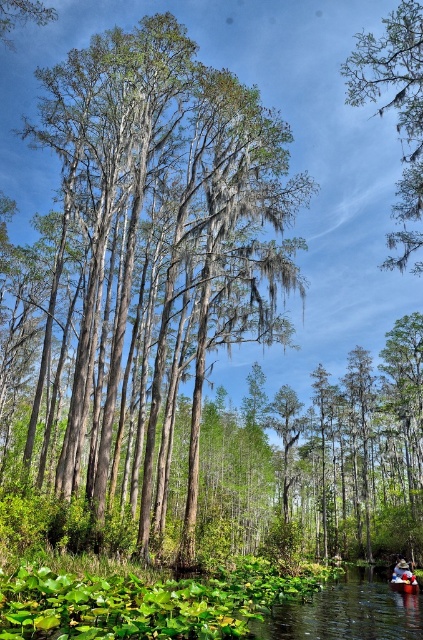
Question: Which point is closer to the camera?

Choices:
 (A) green mossy branch at upper right
 (B) green leafy river at lower center
 (C) fluffy white teddy bear at lower right
 (D) wooden canoe at center

Answer: (B)

Question: Is green mossy branch at upper right to the right of green leafy river at lower center from the viewer's perspective?

Choices:
 (A) yes
 (B) no

Answer: (A)

Question: Which of the following is the farthest from the observer?

Choices:
 (A) smooth bark tree at center
 (B) fluffy white teddy bear at lower right
 (C) wooden canoe at center

Answer: (B)

Question: Is smooth bark tree at center behind green mossy branch at upper right?

Choices:
 (A) yes
 (B) no

Answer: (A)

Question: Among these objects, which one is nearest to the camera?

Choices:
 (A) green mossy branch at upper right
 (B) green leafy river at lower center
 (C) fluffy white teddy bear at lower right

Answer: (B)

Question: Does smooth bark tree at center have a lesser width compared to green leafy river at lower center?

Choices:
 (A) yes
 (B) no

Answer: (B)